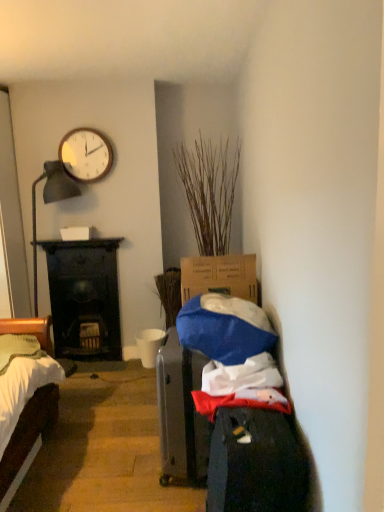
Question: Is dark wood fireplace at left oriented towards dry wood plant at center?

Choices:
 (A) no
 (B) yes

Answer: (A)

Question: Can you confirm if dark wood fireplace at left is bigger than dry wood plant at center?

Choices:
 (A) no
 (B) yes

Answer: (A)

Question: From the image's perspective, is dark wood fireplace at left on dry wood plant at center?

Choices:
 (A) yes
 (B) no

Answer: (B)

Question: Does dark wood fireplace at left appear on the right side of dry wood plant at center?

Choices:
 (A) no
 (B) yes

Answer: (A)

Question: Does dark wood fireplace at left have a lesser width compared to dry wood plant at center?

Choices:
 (A) yes
 (B) no

Answer: (A)

Question: Based on their positions, is dark wood fireplace at left located to the left or right of white matte cup at center?

Choices:
 (A) right
 (B) left

Answer: (B)

Question: Considering the positions of dark wood fireplace at left and white matte cup at center in the image, is dark wood fireplace at left bigger or smaller than white matte cup at center?

Choices:
 (A) big
 (B) small

Answer: (A)

Question: Considering their positions, is dark wood fireplace at left located in front of or behind white matte cup at center?

Choices:
 (A) front
 (B) behind

Answer: (A)

Question: Is point (84, 353) closer or farther from the camera than point (140, 342)?

Choices:
 (A) farther
 (B) closer

Answer: (A)

Question: From their relative heights in the image, would you say wooden clock at upper left is taller or shorter than dry wood plant at center?

Choices:
 (A) tall
 (B) short

Answer: (B)

Question: From the image's perspective, relative to dry wood plant at center, is wooden clock at upper left above or below?

Choices:
 (A) below
 (B) above

Answer: (B)

Question: Considering the positions of point (100, 175) and point (216, 181), is point (100, 175) closer or farther from the camera than point (216, 181)?

Choices:
 (A) closer
 (B) farther

Answer: (B)

Question: Looking at their shapes, would you say wooden clock at upper left is wider or thinner than dry wood plant at center?

Choices:
 (A) wide
 (B) thin

Answer: (B)

Question: From a real-world perspective, is dark wood fireplace at left above or below wooden clock at upper left?

Choices:
 (A) below
 (B) above

Answer: (A)

Question: From their relative heights in the image, would you say dark wood fireplace at left is taller or shorter than wooden clock at upper left?

Choices:
 (A) short
 (B) tall

Answer: (B)